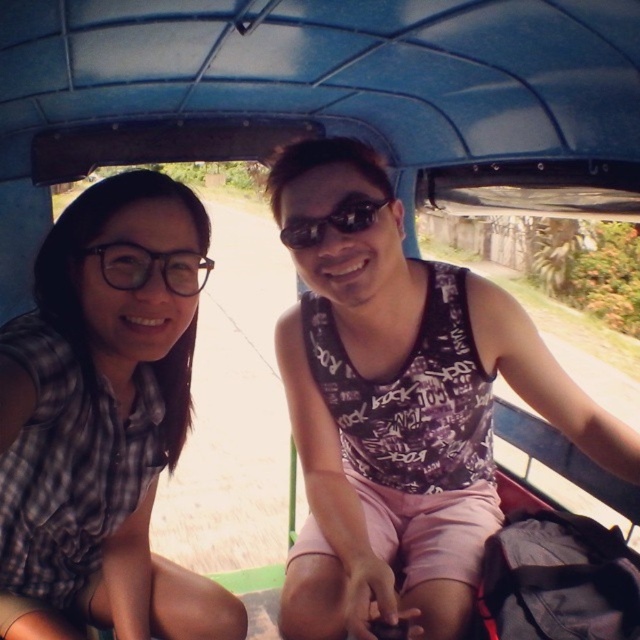
Question: Which object is farther from the camera taking this photo?

Choices:
 (A) transparent plastic glasses at left
 (B) plaid fabric shirt at left
 (C) sunglasses at center
 (D) matte black tank top at center

Answer: (C)

Question: Can you confirm if plaid fabric shirt at left is bigger than sunglasses at center?

Choices:
 (A) no
 (B) yes

Answer: (B)

Question: Which of the following is the farthest from the observer?

Choices:
 (A) matte black tank top at center
 (B) transparent plastic glasses at left
 (C) plaid fabric shirt at left
 (D) sunglasses at center

Answer: (D)

Question: Can you confirm if matte black tank top at center is wider than transparent plastic glasses at left?

Choices:
 (A) yes
 (B) no

Answer: (A)

Question: Considering the relative positions of matte black tank top at center and sunglasses at center in the image provided, where is matte black tank top at center located with respect to sunglasses at center?

Choices:
 (A) right
 (B) left

Answer: (A)

Question: Which of the following is the closest to the observer?

Choices:
 (A) sunglasses at center
 (B) transparent plastic glasses at left
 (C) plaid fabric shirt at left
 (D) matte black tank top at center

Answer: (C)